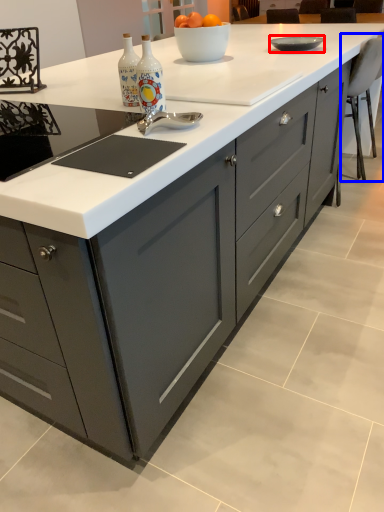
Question: Which object appears closest to the camera in this image, bowl (highlighted by a red box) or chair (highlighted by a blue box)?

Choices:
 (A) bowl
 (B) chair

Answer: (A)